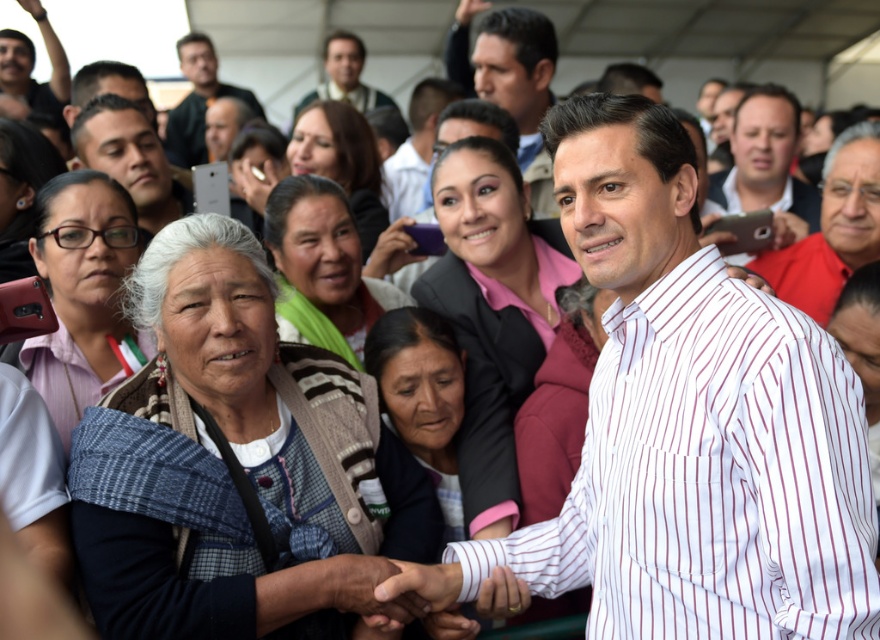
How distant is smooth brown hair at center from matte black phone at upper left?

The distance of smooth brown hair at center from matte black phone at upper left is 1.84 meters.

In the scene shown: Does smooth brown hair at center have a lesser width compared to matte black phone at upper left?

Yes, smooth brown hair at center is thinner than matte black phone at upper left.

The height and width of the screenshot is (640, 880). In order to click on smooth brown hair at center in this screenshot , I will do `click(511, 81)`.

Who is positioned more to the left, red shirt at right or matte black phone at upper left?

From the viewer's perspective, matte black phone at upper left appears more on the left side.

Between red shirt at right and matte black phone at upper left, which one is positioned lower?

red shirt at right

Does point (849, 230) come in front of point (94, 136)?

Yes, point (849, 230) is in front of point (94, 136).

You are a GUI agent. You are given a task and a screenshot of the screen. Output one action in this format:
    pyautogui.click(x=<x>, y=<y>)
    Task: Click on the red shirt at right
    The height and width of the screenshot is (640, 880).
    Given the screenshot: What is the action you would take?
    pyautogui.click(x=832, y=227)

Between white striped shirt at center and matte black suit at upper center, which one is positioned higher?

matte black suit at upper center is above.

Looking at this image, does white striped shirt at center have a smaller size compared to matte black suit at upper center?

Correct, white striped shirt at center occupies less space than matte black suit at upper center.

Find the location of a particular element. The height and width of the screenshot is (640, 880). white striped shirt at center is located at coordinates (688, 426).

This screenshot has height=640, width=880. Find the location of `white striped shirt at center`. white striped shirt at center is located at coordinates (688, 426).